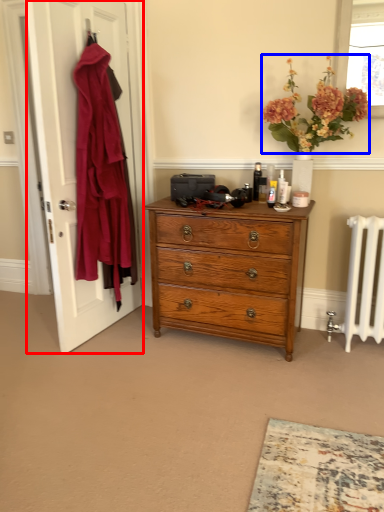
Question: Which object is closer to the camera taking this photo, door (highlighted by a red box) or flower (highlighted by a blue box)?

Choices:
 (A) door
 (B) flower

Answer: (B)